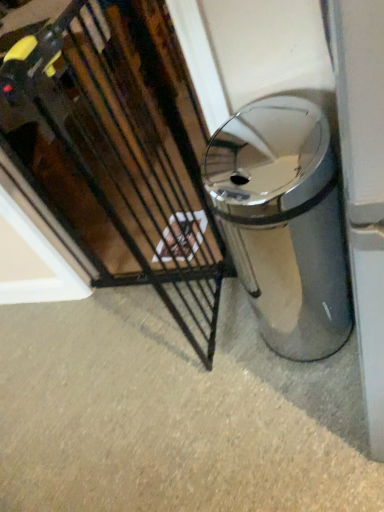
What do you see at coordinates (283, 223) in the screenshot?
I see `polished stainless steel trash can at center` at bounding box center [283, 223].

This screenshot has width=384, height=512. I want to click on polished stainless steel trash can at center, so (x=283, y=223).

Measure the distance between polished stainless steel trash can at center and camera.

They are 34.85 inches apart.

What are the coordinates of `black metal gate at center` in the screenshot? It's located at (121, 152).

What do you see at coordinates (121, 152) in the screenshot?
I see `black metal gate at center` at bounding box center [121, 152].

I want to click on polished stainless steel trash can at center, so click(283, 223).

Is polished stainless steel trash can at center to the right of black metal gate at center from the viewer's perspective?

Indeed, polished stainless steel trash can at center is positioned on the right side of black metal gate at center.

Considering the relative positions of polished stainless steel trash can at center and black metal gate at center in the image provided, is polished stainless steel trash can at center behind black metal gate at center?

Yes, it is behind black metal gate at center.

Does point (274, 136) come closer to viewer compared to point (152, 150)?

Yes, it is.

Consider the image. From the image's perspective, is polished stainless steel trash can at center above or below black metal gate at center?

Clearly, from the image's perspective, polished stainless steel trash can at center is below black metal gate at center.

From a real-world perspective, is polished stainless steel trash can at center physically below black metal gate at center?

Yes, from a real-world perspective, polished stainless steel trash can at center is beneath black metal gate at center.

Which object is wider, polished stainless steel trash can at center or black metal gate at center?

Wider between the two is polished stainless steel trash can at center.

Considering the relative sizes of polished stainless steel trash can at center and black metal gate at center in the image provided, is polished stainless steel trash can at center taller than black metal gate at center?

No, polished stainless steel trash can at center is not taller than black metal gate at center.

Between polished stainless steel trash can at center and black metal gate at center, which one has larger size?

Bigger between the two is black metal gate at center.

Is polished stainless steel trash can at center not within black metal gate at center?

Yes.

Is polished stainless steel trash can at center positioned far away from black metal gate at center?

No.

Is polished stainless steel trash can at center oriented away from black metal gate at center?

polished stainless steel trash can at center does not have its back to black metal gate at center.

Locate an element on the screen. cage that appears in front of the polished stainless steel trash can at center is located at coordinates (121, 152).

Considering the positions of objects black metal gate at center and polished stainless steel trash can at center in the image provided, who is more to the left, black metal gate at center or polished stainless steel trash can at center?

Positioned to the left is black metal gate at center.

Does black metal gate at center come in front of polished stainless steel trash can at center?

Yes, black metal gate at center is closer to the camera.

Which is in front, point (72, 76) or point (267, 164)?

Positioned in front is point (267, 164).

From the image's perspective, relative to polished stainless steel trash can at center, is black metal gate at center above or below?

Based on their image positions, black metal gate at center is located above polished stainless steel trash can at center.

From a real-world perspective, is black metal gate at center on polished stainless steel trash can at center?

Yes.

Which of these two, black metal gate at center or polished stainless steel trash can at center, is wider?

With larger width is polished stainless steel trash can at center.

Consider the image. In terms of height, does black metal gate at center look taller or shorter compared to polished stainless steel trash can at center?

black metal gate at center is taller than polished stainless steel trash can at center.

Considering the relative sizes of black metal gate at center and polished stainless steel trash can at center in the image provided, is black metal gate at center smaller than polished stainless steel trash can at center?

Actually, black metal gate at center might be larger than polished stainless steel trash can at center.

Can polished stainless steel trash can at center be found inside black metal gate at center?

No, black metal gate at center does not contain polished stainless steel trash can at center.

Is black metal gate at center not close to polished stainless steel trash can at center?

Actually, black metal gate at center and polished stainless steel trash can at center are a little close together.

Is black metal gate at center oriented towards polished stainless steel trash can at center?

Yes.

Based on the photo, can you tell me how much black metal gate at center and polished stainless steel trash can at center differ in facing direction?

90 degrees.

Identify the location of waste container to the right of black metal gate at center. The height and width of the screenshot is (512, 384). (283, 223).

In the image, there is a black metal gate at center. Where is `waste container below it (from a real-world perspective)`? This screenshot has width=384, height=512. waste container below it (from a real-world perspective) is located at coordinates (283, 223).

You are a GUI agent. You are given a task and a screenshot of the screen. Output one action in this format:
    pyautogui.click(x=<x>, y=<y>)
    Task: Click on the cage lying on the left of polished stainless steel trash can at center
    
    Given the screenshot: What is the action you would take?
    pyautogui.click(x=121, y=152)